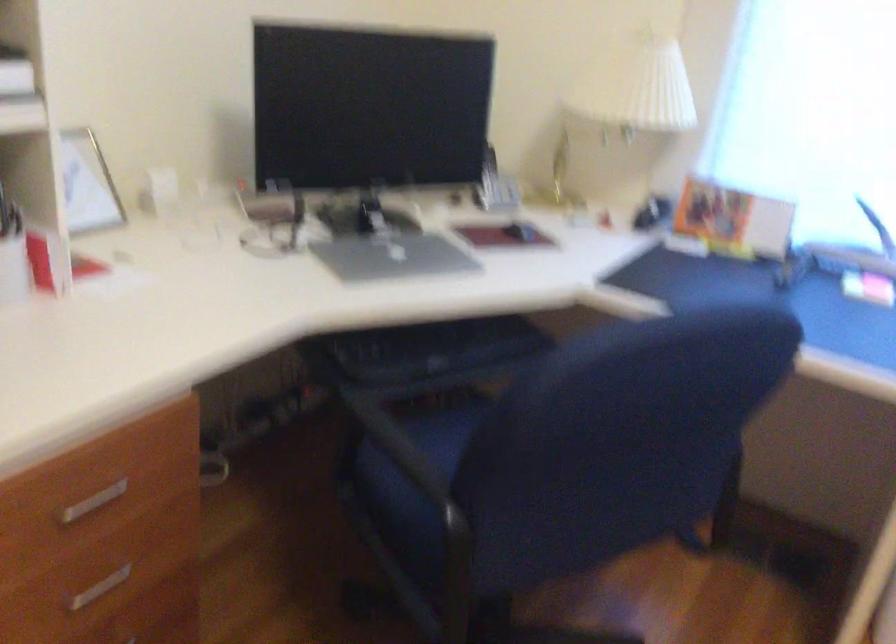
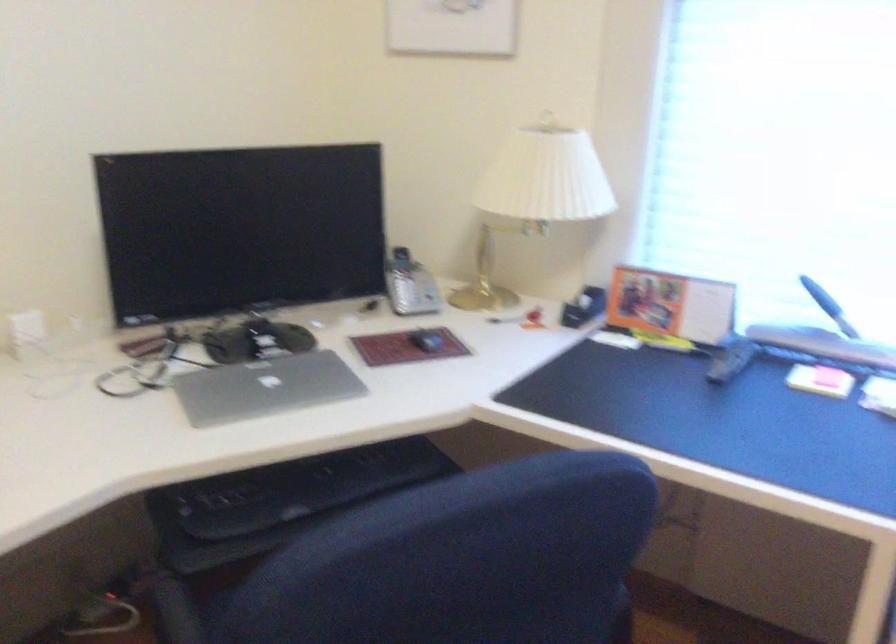
The point at (487, 178) is marked in the first image. Where is the corresponding point in the second image?

(401, 281)